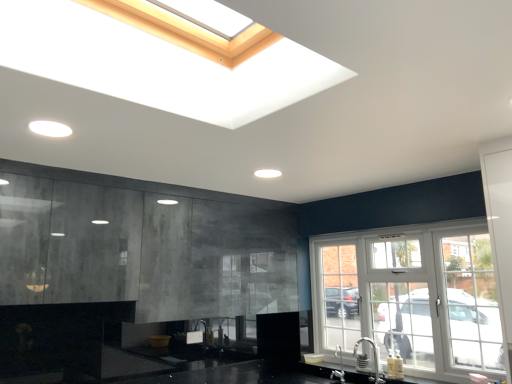
Question: Should I look upward or downward to see white glass window at right?

Choices:
 (A) down
 (B) up

Answer: (A)

Question: From a real-world perspective, is white glass window at right below matte concrete cabinets at left?

Choices:
 (A) yes
 (B) no

Answer: (A)

Question: Considering the relative sizes of white glass window at right and matte concrete cabinets at left in the image provided, is white glass window at right shorter than matte concrete cabinets at left?

Choices:
 (A) no
 (B) yes

Answer: (A)

Question: Does white glass window at right come in front of matte concrete cabinets at left?

Choices:
 (A) no
 (B) yes

Answer: (A)

Question: Would you say white glass window at right is outside matte concrete cabinets at left?

Choices:
 (A) no
 (B) yes

Answer: (B)

Question: Would you say white glass window at right is a long distance from matte concrete cabinets at left?

Choices:
 (A) no
 (B) yes

Answer: (B)

Question: Considering the relative sizes of white glass window at right and matte concrete cabinets at left in the image provided, is white glass window at right bigger than matte concrete cabinets at left?

Choices:
 (A) no
 (B) yes

Answer: (A)

Question: From a real-world perspective, is satin nickel faucet at lower center, the 2th faucet viewed from the left, physically above matte concrete cabinets at left?

Choices:
 (A) yes
 (B) no

Answer: (B)

Question: Does satin nickel faucet at lower center, which is the first faucet from right to left, turn towards matte concrete cabinets at left?

Choices:
 (A) yes
 (B) no

Answer: (B)

Question: Considering the relative positions of satin nickel faucet at lower center, which is the first faucet from right to left, and matte concrete cabinets at left in the image provided, is satin nickel faucet at lower center, which is the first faucet from right to left, to the right of matte concrete cabinets at left from the viewer's perspective?

Choices:
 (A) no
 (B) yes

Answer: (B)

Question: From a real-world perspective, is satin nickel faucet at lower center, the 2th faucet viewed from the left, physically below matte concrete cabinets at left?

Choices:
 (A) yes
 (B) no

Answer: (A)

Question: Is satin nickel faucet at lower center, which ranks as the second faucet in back-to-front order, closer to camera compared to matte concrete cabinets at left?

Choices:
 (A) no
 (B) yes

Answer: (A)

Question: Is satin nickel faucet at lower center, the first faucet positioned from the front, far from matte concrete cabinets at left?

Choices:
 (A) no
 (B) yes

Answer: (B)

Question: Considering the relative sizes of matte concrete cabinets at left and satin nickel faucet at lower center, which ranks as the second faucet in back-to-front order, in the image provided, is matte concrete cabinets at left wider than satin nickel faucet at lower center, which ranks as the second faucet in back-to-front order,?

Choices:
 (A) no
 (B) yes

Answer: (B)